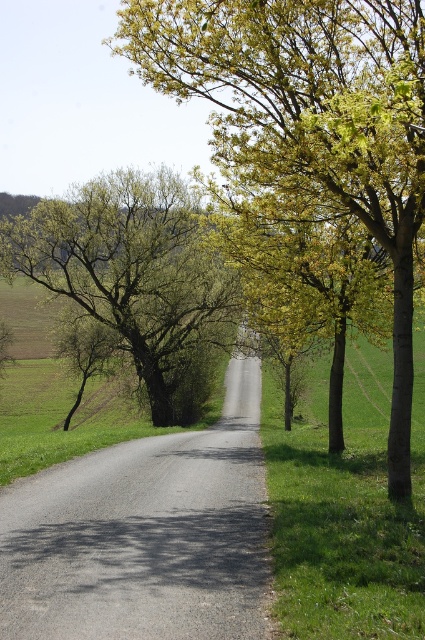
You are a cyclist planning to ride along the road shown in the image. You want to know if you can safely pass between the green leafy tree at center and the green leafy tree at left without hitting either tree. The width of your bicycle is 0.6 meters. Can you safely navigate this path?

The distance between the green leafy tree at center and the green leafy tree at left is 13.18 meters. Since the bicycle is only 0.6 meters wide, there is ample space to safely pass between them without hitting either tree.

You are driving a car and want to park between the green leafy tree at center and the green leafy tree at left. Considering their sizes, which tree would you need to leave more space for to avoid hitting it?

The green leafy tree at center is larger in size than the green leafy tree at left, so you should leave more space for the green leafy tree at center to avoid hitting it.

You are a hiker standing on the paved road and looking towards the horizon. You notice two trees ahead of you. Which tree, the green leafy tree at center or the green leafy tree at left, is positioned higher in your field of view?

The green leafy tree at center is positioned higher in your field of view because it is above the green leafy tree at left.